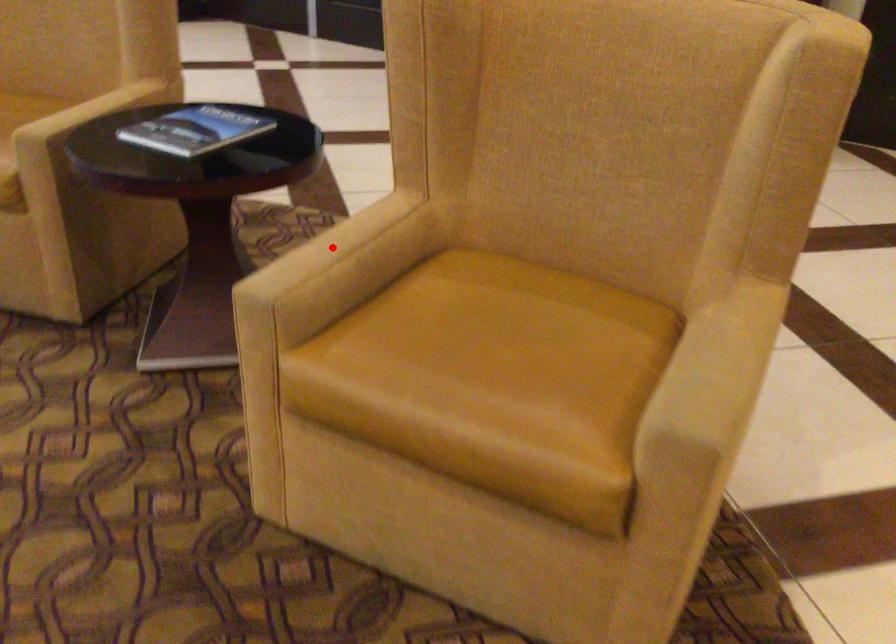
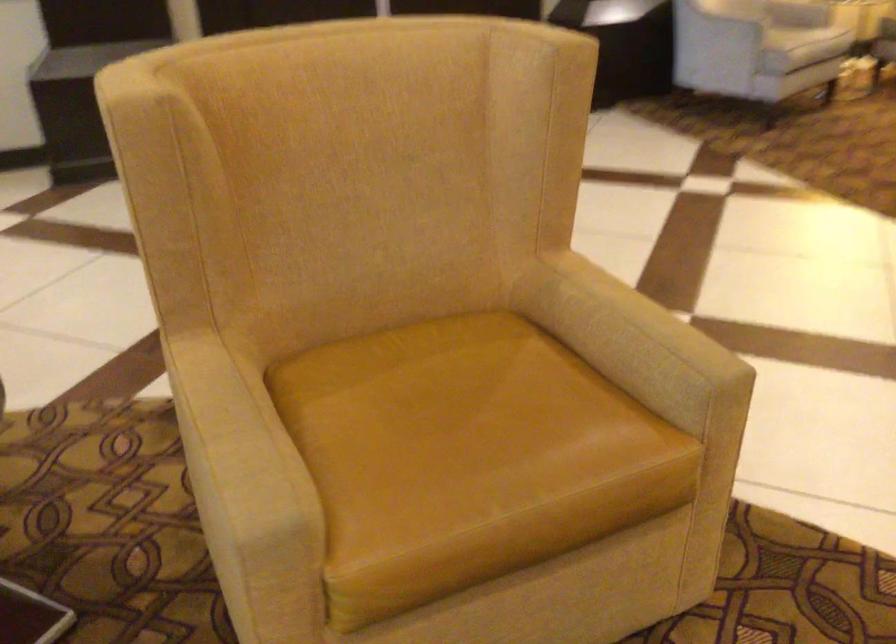
Question: I am providing you with two images of the same scene from different viewpoints. Image1 has a red point marked. In image2, the corresponding 3D location appears at what relative position? Reply with the corresponding letter.

Choices:
 (A) Closer
 (B) Farther

Answer: (A)